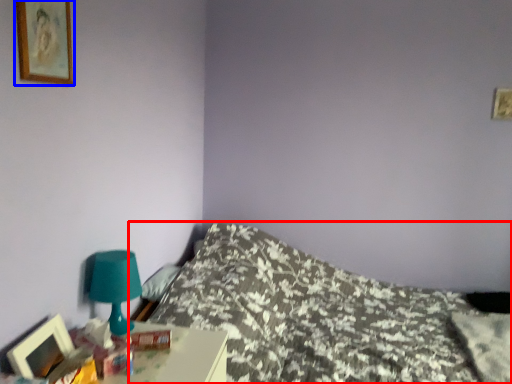
Question: Which of the following is the farthest to the observer, bed (highlighted by a red box) or picture frame (highlighted by a blue box)?

Choices:
 (A) bed
 (B) picture frame

Answer: (A)